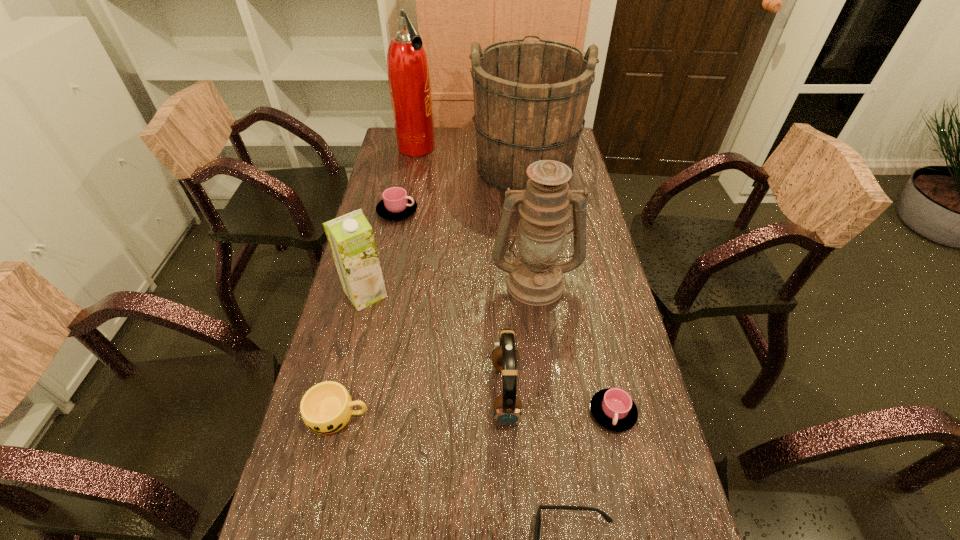
Where is `vacant space situated on the front of the beige cup`? vacant space situated on the front of the beige cup is located at coordinates (326, 466).

Locate an element on the screen. vacant position located on the side with the handle of the right pink cup is located at coordinates (628, 481).

This screenshot has height=540, width=960. What are the coordinates of `fire extinguisher that is at the far edge` in the screenshot? It's located at (408, 73).

Locate an element on the screen. Image resolution: width=960 pixels, height=540 pixels. bucket that is at the far edge is located at coordinates (530, 97).

Locate an element on the screen. The height and width of the screenshot is (540, 960). fire extinguisher located in the left edge section of the desktop is located at coordinates (408, 73).

The height and width of the screenshot is (540, 960). I want to click on soya milk that is at the left edge, so click(351, 239).

The image size is (960, 540). In order to click on bucket at the right edge in this screenshot , I will do `click(530, 97)`.

In order to click on oil lamp that is at the right edge in this screenshot , I will do `click(535, 277)`.

This screenshot has height=540, width=960. What are the coordinates of `cup that is positioned at the right edge` in the screenshot? It's located at (613, 408).

Where is `object that is at the far left corner`? The width and height of the screenshot is (960, 540). object that is at the far left corner is located at coordinates (408, 73).